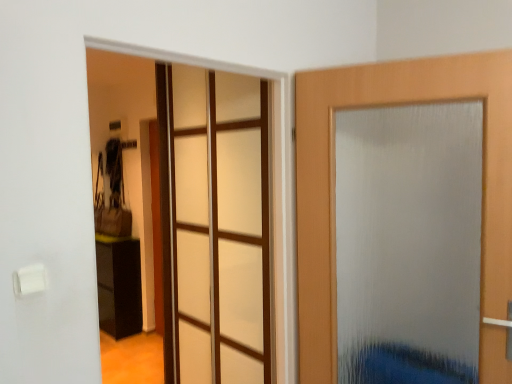
Question: From a real-world perspective, is black glossy cabinet at lower left positioned over frosted glass door at right based on gravity?

Choices:
 (A) no
 (B) yes

Answer: (A)

Question: Considering the relative sizes of black glossy cabinet at lower left and frosted glass door at right in the image provided, is black glossy cabinet at lower left thinner than frosted glass door at right?

Choices:
 (A) no
 (B) yes

Answer: (A)

Question: Does black glossy cabinet at lower left have a smaller size compared to frosted glass door at right?

Choices:
 (A) yes
 (B) no

Answer: (B)

Question: From the image's perspective, is black glossy cabinet at lower left on top of frosted glass door at right?

Choices:
 (A) no
 (B) yes

Answer: (A)

Question: From a real-world perspective, is black glossy cabinet at lower left under frosted glass door at right?

Choices:
 (A) yes
 (B) no

Answer: (A)

Question: Relative to transparent glass door at center, is frosted glass door at right in front or behind?

Choices:
 (A) front
 (B) behind

Answer: (A)

Question: From a real-world perspective, is frosted glass door at right physically located above or below transparent glass door at center?

Choices:
 (A) below
 (B) above

Answer: (B)

Question: Is frosted glass door at right bigger or smaller than transparent glass door at center?

Choices:
 (A) small
 (B) big

Answer: (A)

Question: Considering the positions of point (330, 233) and point (209, 193), is point (330, 233) closer or farther from the camera than point (209, 193)?

Choices:
 (A) closer
 (B) farther

Answer: (A)

Question: Is transparent glass door at center bigger or smaller than frosted glass door at right?

Choices:
 (A) small
 (B) big

Answer: (B)

Question: From the image's perspective, is transparent glass door at center located above or below frosted glass door at right?

Choices:
 (A) above
 (B) below

Answer: (B)

Question: Would you say transparent glass door at center is to the left or to the right of frosted glass door at right in the picture?

Choices:
 (A) right
 (B) left

Answer: (B)

Question: Is point (182, 104) closer or farther from the camera than point (390, 87)?

Choices:
 (A) farther
 (B) closer

Answer: (A)

Question: From the image's perspective, relative to frosted glass door at right, is black glossy cabinet at lower left above or below?

Choices:
 (A) below
 (B) above

Answer: (A)

Question: In the image, is black glossy cabinet at lower left on the left side or the right side of frosted glass door at right?

Choices:
 (A) right
 (B) left

Answer: (B)